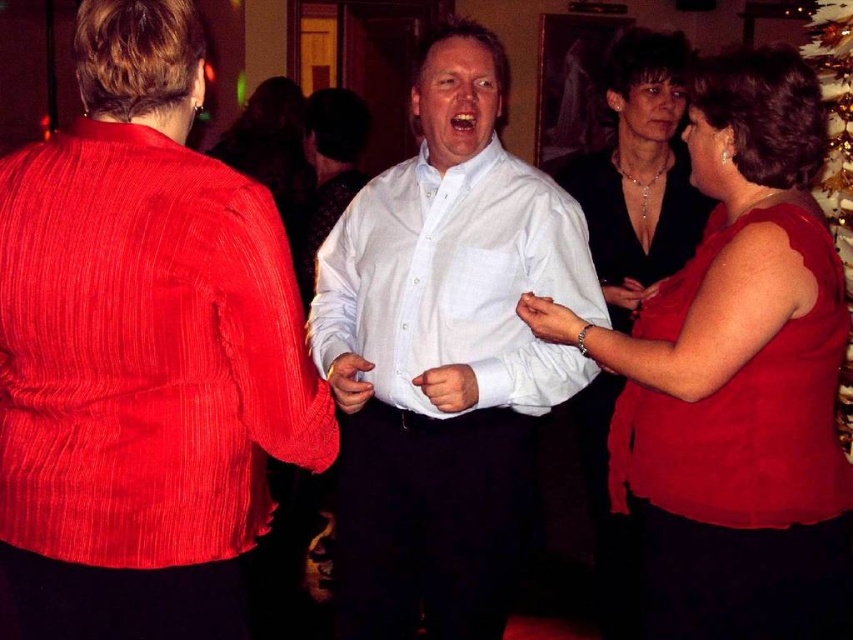
You are at a party and want to take a photo of both the white matte shirt at center and the gold glittering christmas tree at upper right. Which one should you focus on first to ensure both are in focus?

You should focus on the white matte shirt at center first because it is closer to the viewer than the gold glittering christmas tree at upper right, so adjusting focus from near to far will help both be in focus.

What is the color of the clothing item located at the coordinates point (735, 380)?

The point (735, 380) corresponds to the matte red blouse at center, so the color is red.